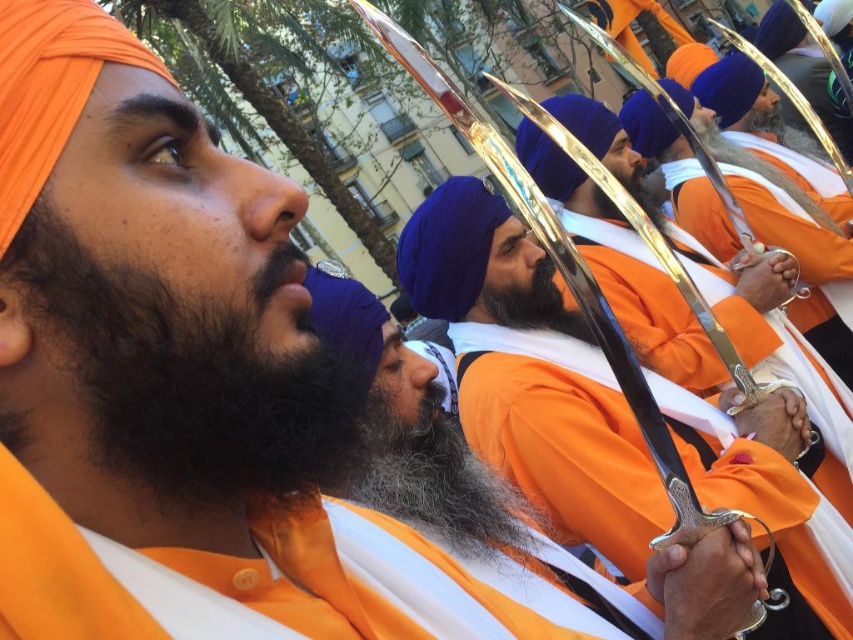
Is shiny silver sword at center thinner than dark brown curly beard at left?

No, shiny silver sword at center is not thinner than dark brown curly beard at left.

Can you confirm if shiny silver sword at center is positioned to the right of dark brown curly beard at left?

Yes, shiny silver sword at center is to the right of dark brown curly beard at left.

Who is more forward, (788, 493) or (22, 268)?

Point (22, 268) is in front.

This screenshot has width=853, height=640. Find the location of `shiny silver sword at center`. shiny silver sword at center is located at coordinates click(531, 374).